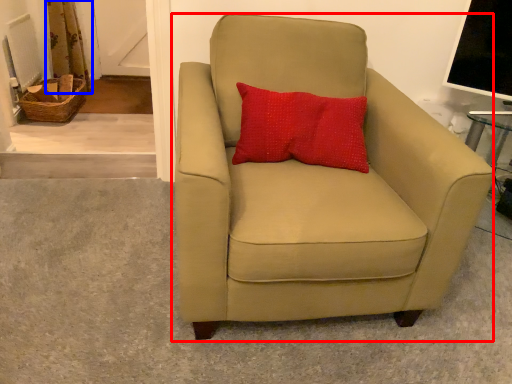
Question: Which object appears farthest to the camera in this image, chair (highlighted by a red box) or curtain (highlighted by a blue box)?

Choices:
 (A) chair
 (B) curtain

Answer: (B)